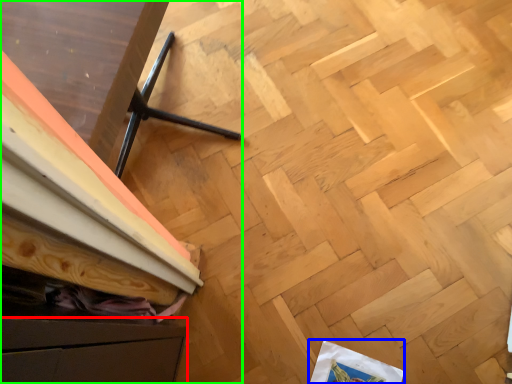
Question: Estimate the real-world distances between objects in this image. Which object is farther from drawer (highlighted by a red box), wrapping paper (highlighted by a blue box) or furniture (highlighted by a green box)?

Choices:
 (A) wrapping paper
 (B) furniture

Answer: (A)